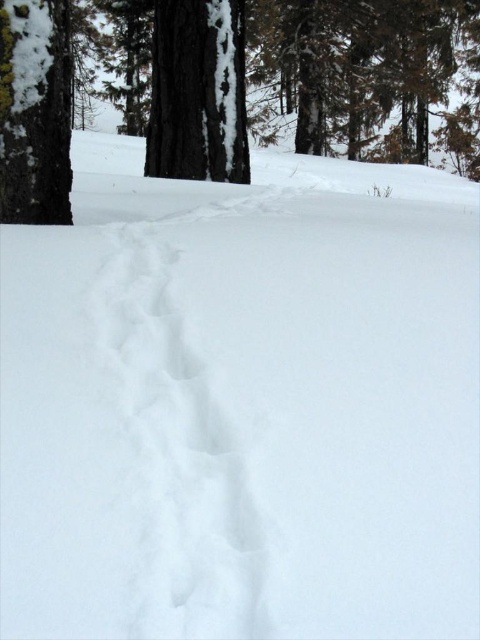
Does white fluffy snow trail at center have a lesser height compared to smooth bark tree at center?

Yes, white fluffy snow trail at center is shorter than smooth bark tree at center.

Is white fluffy snow trail at center below smooth bark tree at center?

Yes, white fluffy snow trail at center is below smooth bark tree at center.

Who is more forward, (x=151, y=280) or (x=206, y=10)?

Point (x=151, y=280) is in front.

At what (x,y) coordinates should I click in order to perform the action: click on white fluffy snow trail at center. Please return your answer as a coordinate pair (x, y). Looking at the image, I should click on (177, 454).

Who is more distant from viewer, (379, 150) or (238, 8)?

The point (379, 150) is more distant.

Can you confirm if brown rough tree at center is taller than smooth bark tree at center?

Indeed, brown rough tree at center has a greater height compared to smooth bark tree at center.

Which is in front, point (339, 81) or point (183, 116)?

Point (183, 116)

Find the location of a particular element. brown rough tree at center is located at coordinates (300, 80).

Who is more forward, (250,68) or (251,589)?

Positioned in front is point (251,589).

Based on the photo, does brown rough tree at center have a greater width compared to white fluffy snow trail at center?

Correct, the width of brown rough tree at center exceeds that of white fluffy snow trail at center.

Does point (457, 33) come closer to viewer compared to point (191, 406)?

No, (457, 33) is behind (191, 406).

Identify the location of brown rough tree at center. (300, 80).